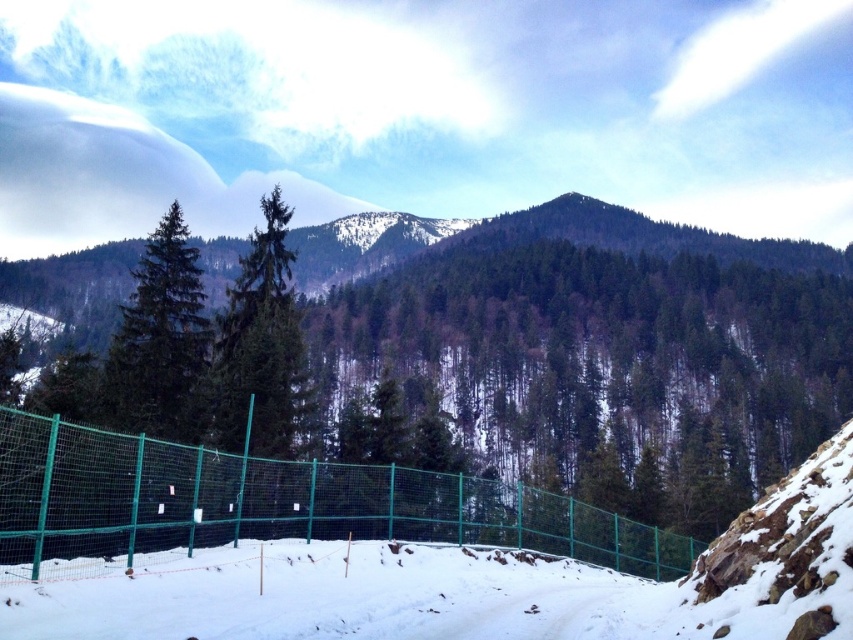
This screenshot has width=853, height=640. In order to click on green mesh fence at lower left in this screenshot , I will do (277, 502).

Is point (97, 554) positioned in front of point (374, 572)?

Yes, point (97, 554) is in front of point (374, 572).

Is point (265, 508) positioned after point (277, 540)?

That is False.

Where is `green mesh fence at lower left`? This screenshot has width=853, height=640. green mesh fence at lower left is located at coordinates (277, 502).

Is point (312, 328) more distant than point (509, 532)?

Yes.

Who is higher up, green wire mesh fence at center or green mesh fence at lower left?

green wire mesh fence at center is higher up.

Who is more forward, (225, 504) or (57, 461)?

Positioned in front is point (57, 461).

You are a GUI agent. You are given a task and a screenshot of the screen. Output one action in this format:
    pyautogui.click(x=<x>, y=<y>)
    Task: Click on the green wire mesh fence at center
    The width and height of the screenshot is (853, 640).
    Given the screenshot: What is the action you would take?
    pyautogui.click(x=460, y=403)

Between point (225, 618) and point (247, 305), which one is positioned behind?

Positioned behind is point (247, 305).

Who is more forward, (41, 620) or (248, 371)?

Positioned in front is point (41, 620).

Locate an element on the screen. The image size is (853, 640). white snow ski slope at lower center is located at coordinates (x=329, y=595).